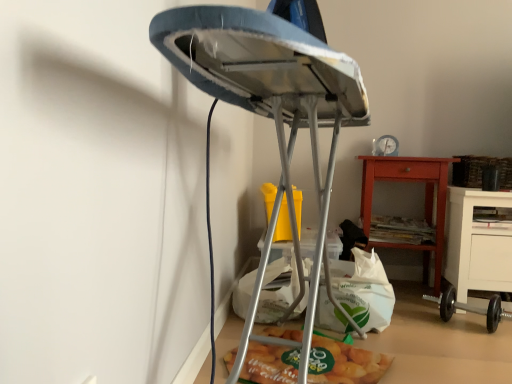
You are a GUI agent. You are given a task and a screenshot of the screen. Output one action in this format:
    pyautogui.click(x=<x>, y=<y>)
    Task: Click on the matte orange wooden nightstand at lower right
    
    Given the screenshot: What is the action you would take?
    pyautogui.click(x=424, y=204)

The width and height of the screenshot is (512, 384). Identify the location of white paper bag at lower center. (364, 290).

This screenshot has width=512, height=384. Describe the element at coordinates (364, 290) in the screenshot. I see `white paper bag at lower center` at that location.

In order to face black rubber dumbbell at lower right, should I rotate leftwards or rightwards?

It's best to rotate right around 26.180 degrees.

You are a GUI agent. You are given a task and a screenshot of the screen. Output one action in this format:
    pyautogui.click(x=<x>, y=<y>)
    Task: Click on the matte plastic bag of chips at lower center
    
    Given the screenshot: What is the action you would take?
    pyautogui.click(x=344, y=363)

What do you see at coordinates (344, 363) in the screenshot?
I see `matte plastic bag of chips at lower center` at bounding box center [344, 363].

What do you see at coordinates (270, 91) in the screenshot? I see `metallic ironing board at center` at bounding box center [270, 91].

Where is `matte orange wooden nightstand at lower right`? This screenshot has width=512, height=384. matte orange wooden nightstand at lower right is located at coordinates (424, 204).

Considering their positions, is matte orange wooden nightstand at lower right located in front of or behind metallic ironing board at center?

matte orange wooden nightstand at lower right is behind metallic ironing board at center.

Is matte orange wooden nightstand at lower right not near metallic ironing board at center?

Absolutely, matte orange wooden nightstand at lower right is distant from metallic ironing board at center.

Considering the positions of objects matte orange wooden nightstand at lower right and metallic ironing board at center in the image provided, who is more to the left, matte orange wooden nightstand at lower right or metallic ironing board at center?

metallic ironing board at center is more to the left.

Can you tell me how much matte orange wooden nightstand at lower right and metallic ironing board at center differ in facing direction?

They differ by 180 degrees in their facing directions.

Is the position of white paper bag at lower center more distant than that of matte plastic bag of chips at lower center?

That is True.

Where is `shopping bag above the matte plastic bag of chips at lower center (from a real-world perspective)`? shopping bag above the matte plastic bag of chips at lower center (from a real-world perspective) is located at coordinates (364, 290).

From the image's perspective, is white paper bag at lower center on top of matte plastic bag of chips at lower center?

Yes, from the image's perspective, white paper bag at lower center is over matte plastic bag of chips at lower center.

Is point (358, 266) behind point (283, 327)?

Yes, point (358, 266) is behind point (283, 327).

Measure the distance between matte orange wooden nightstand at lower right and black rubber dumbbell at lower right.

They are 16.99 inches apart.

Considering the sizes of objects matte orange wooden nightstand at lower right and black rubber dumbbell at lower right in the image provided, who is bigger, matte orange wooden nightstand at lower right or black rubber dumbbell at lower right?

matte orange wooden nightstand at lower right is bigger.

From their relative heights in the image, would you say matte orange wooden nightstand at lower right is taller or shorter than black rubber dumbbell at lower right?

In the image, matte orange wooden nightstand at lower right appears to be taller than black rubber dumbbell at lower right.

Does matte orange wooden nightstand at lower right contain black rubber dumbbell at lower right?

No.

Is metallic ironing board at center with white paper bag at lower center?

They are not placed beside each other.

Is metallic ironing board at center facing towards white paper bag at lower center?

Yes, metallic ironing board at center is facing white paper bag at lower center.

Considering the relative sizes of metallic ironing board at center and white paper bag at lower center in the image provided, is metallic ironing board at center bigger than white paper bag at lower center?

Yes, metallic ironing board at center is bigger than white paper bag at lower center.

Locate an element on the screen. shopping bag behind the metallic ironing board at center is located at coordinates (364, 290).

Is point (364, 261) closer to viewer compared to point (439, 297)?

Yes, it is in front of point (439, 297).

The image size is (512, 384). I want to click on shopping bag in front of the black rubber dumbbell at lower right, so click(364, 290).

Which object is positioned more to the left, white paper bag at lower center or black rubber dumbbell at lower right?

Positioned to the left is white paper bag at lower center.

Does point (323, 227) come behind point (390, 361)?

No, it is in front of (390, 361).

Which object is closer to the camera taking this photo, metallic ironing board at center or matte plastic bag of chips at lower center?

metallic ironing board at center is in front.

Is metallic ironing board at center thinner than matte plastic bag of chips at lower center?

No.

Are metallic ironing board at center and matte plastic bag of chips at lower center beside each other?

No, metallic ironing board at center is not touching matte plastic bag of chips at lower center.

The image size is (512, 384). Identify the location of shopping bag that appears behind the metallic ironing board at center. (364, 290).

Which is behind, point (351, 270) or point (279, 135)?

Point (351, 270)

Considering the relative sizes of white paper bag at lower center and metallic ironing board at center in the image provided, is white paper bag at lower center shorter than metallic ironing board at center?

Yes.

The width and height of the screenshot is (512, 384). Find the location of `nightstand that is above the metallic ironing board at center (from the image's perspective)`. nightstand that is above the metallic ironing board at center (from the image's perspective) is located at coordinates (424, 204).

Identify the location of shopping bag that is above the matte plastic bag of chips at lower center (from a real-world perspective). The height and width of the screenshot is (384, 512). (364, 290).

Based on their spatial positions, is matte plastic bag of chips at lower center or black rubber dumbbell at lower right closer to white paper bag at lower center?

The object closer to white paper bag at lower center is matte plastic bag of chips at lower center.

When comparing their distances from black rubber dumbbell at lower right, does white paper bag at lower center or matte orange wooden nightstand at lower right seem further?

Among the two, white paper bag at lower center is located further to black rubber dumbbell at lower right.

Which object lies further to the anchor point white paper bag at lower center, metallic ironing board at center or matte plastic bag of chips at lower center?

metallic ironing board at center is positioned further to the anchor white paper bag at lower center.

Looking at the image, which one is located closer to black rubber dumbbell at lower right, white paper bag at lower center or matte plastic bag of chips at lower center?

The object closer to black rubber dumbbell at lower right is white paper bag at lower center.

Based on their spatial positions, is matte plastic bag of chips at lower center or matte orange wooden nightstand at lower right closer to black rubber dumbbell at lower right?

The object closer to black rubber dumbbell at lower right is matte orange wooden nightstand at lower right.

Looking at the image, which one is located further to black rubber dumbbell at lower right, matte orange wooden nightstand at lower right or white paper bag at lower center?

white paper bag at lower center is further to black rubber dumbbell at lower right.

Which object lies further to the anchor point white paper bag at lower center, matte plastic bag of chips at lower center or metallic ironing board at center?

metallic ironing board at center.

Based on their spatial positions, is black rubber dumbbell at lower right or matte orange wooden nightstand at lower right further from white paper bag at lower center?

Based on the image, matte orange wooden nightstand at lower right appears to be further to white paper bag at lower center.

I want to click on food located between metallic ironing board at center and matte orange wooden nightstand at lower right in the depth direction, so click(x=344, y=363).

At what (x,y) coordinates should I click in order to perform the action: click on food between metallic ironing board at center and white paper bag at lower center along the z-axis. Please return your answer as a coordinate pair (x, y). Looking at the image, I should click on click(344, 363).

Find the location of a particular element. The image size is (512, 384). shopping bag between metallic ironing board at center and black rubber dumbbell at lower right from front to back is located at coordinates (364, 290).

What are the coordinates of `shopping bag between matte plastic bag of chips at lower center and matte orange wooden nightstand at lower right along the z-axis` in the screenshot? It's located at (364, 290).